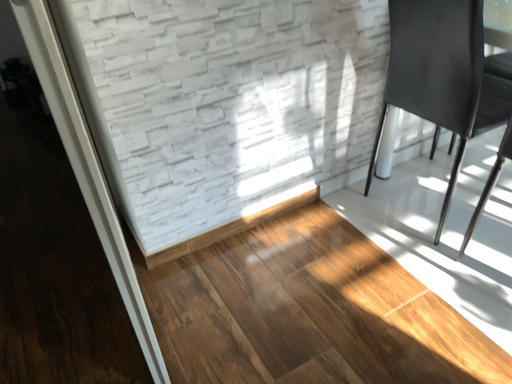
This screenshot has height=384, width=512. What do you see at coordinates (309, 312) in the screenshot? I see `brown wood flooring at center` at bounding box center [309, 312].

The height and width of the screenshot is (384, 512). In order to click on brown wood flooring at center in this screenshot , I will do `click(309, 312)`.

What do you see at coordinates (435, 70) in the screenshot? I see `matte black chair at right` at bounding box center [435, 70].

Locate an element on the screen. matte black chair at right is located at coordinates (435, 70).

Find the location of `brown wood flooring at center`. brown wood flooring at center is located at coordinates (309, 312).

Considering the positions of objects brown wood flooring at center and matte black chair at right in the image provided, who is more to the left, brown wood flooring at center or matte black chair at right?

brown wood flooring at center is more to the left.

Which object is closer to the camera taking this photo, brown wood flooring at center or matte black chair at right?

Positioned in front is brown wood flooring at center.

Does point (264, 324) come farther from viewer compared to point (431, 86)?

No, it is not.

From the image's perspective, is brown wood flooring at center located above or below matte black chair at right?

Based on their image positions, brown wood flooring at center is located beneath matte black chair at right.

From a real-world perspective, is brown wood flooring at center above or below matte black chair at right?

From a real-world perspective, brown wood flooring at center is physically below matte black chair at right.

Can you confirm if brown wood flooring at center is wider than matte black chair at right?

Yes.

Considering the sizes of objects brown wood flooring at center and matte black chair at right in the image provided, who is shorter, brown wood flooring at center or matte black chair at right?

brown wood flooring at center is shorter.

Which of these two, brown wood flooring at center or matte black chair at right, is bigger?

Bigger between the two is matte black chair at right.

Could matte black chair at right be considered to be inside brown wood flooring at center?

No, brown wood flooring at center does not contain matte black chair at right.

Is brown wood flooring at center next to matte black chair at right and touching it?

There is a gap between brown wood flooring at center and matte black chair at right.

Is brown wood flooring at center oriented towards matte black chair at right?

No, brown wood flooring at center does not turn towards matte black chair at right.

Based on the photo, how different are the orientations of brown wood flooring at center and matte black chair at right in degrees?

89.8 degrees.

This screenshot has width=512, height=384. What are the coordinates of `chair on the right of brown wood flooring at center` in the screenshot? It's located at (435, 70).

Which is more to the right, matte black chair at right or brown wood flooring at center?

matte black chair at right.

Which object is closer to the camera taking this photo, matte black chair at right or brown wood flooring at center?

brown wood flooring at center.

Does point (462, 20) come closer to viewer compared to point (308, 212)?

Yes, point (462, 20) is in front of point (308, 212).

From the image's perspective, is matte black chair at right under brown wood flooring at center?

No, from the image's perspective, matte black chair at right is not below brown wood flooring at center.

From a real-world perspective, which is physically above, matte black chair at right or brown wood flooring at center?

matte black chair at right.

Which of these two, matte black chair at right or brown wood flooring at center, is wider?

Wider between the two is brown wood flooring at center.

Does matte black chair at right have a greater height compared to brown wood flooring at center?

Yes.

Who is smaller, matte black chair at right or brown wood flooring at center?

With smaller size is brown wood flooring at center.

Is matte black chair at right situated inside brown wood flooring at center or outside?

matte black chair at right cannot be found inside brown wood flooring at center.

Are matte black chair at right and brown wood flooring at center beside each other?

They are not placed beside each other.

Is matte black chair at right oriented towards brown wood flooring at center?

No, matte black chair at right does not turn towards brown wood flooring at center.

What's the angular difference between matte black chair at right and brown wood flooring at center's facing directions?

They differ by 89.8 degrees in their facing directions.

Identify the location of hardwood in front of the matte black chair at right. tap(309, 312).

In order to click on chair on the right of brown wood flooring at center in this screenshot , I will do `click(435, 70)`.

The height and width of the screenshot is (384, 512). In order to click on hardwood in front of the matte black chair at right in this screenshot , I will do `click(309, 312)`.